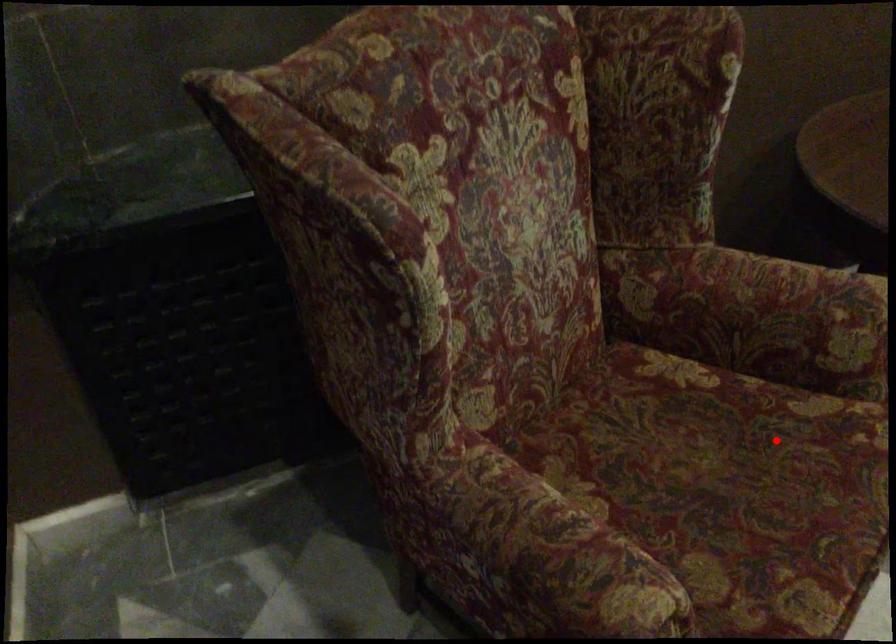
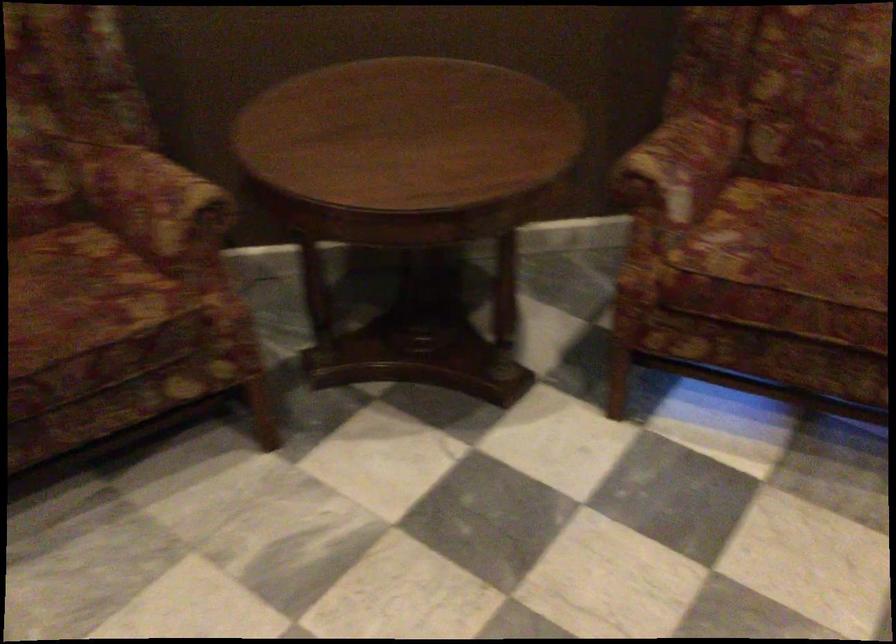
Question: I am providing you with two images of the same scene from different viewpoints. Given a red point in image1, look at the same physical point in image2. Is it:

Choices:
 (A) Closer to the viewpoint
 (B) Farther from the viewpoint

Answer: (B)